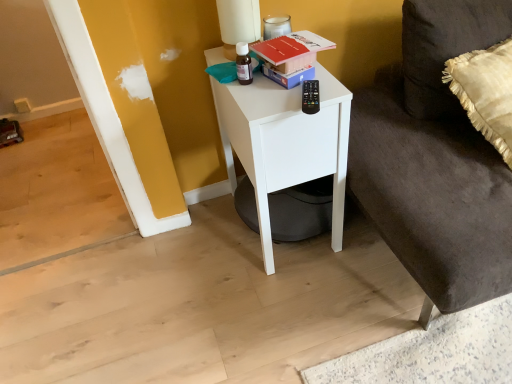
Question: Is white matte nightstand at center at the back of red matte book at upper center?

Choices:
 (A) yes
 (B) no

Answer: (B)

Question: Is red matte book at upper center positioned far away from white matte nightstand at center?

Choices:
 (A) no
 (B) yes

Answer: (A)

Question: From the image's perspective, is red matte book at upper center on top of white matte nightstand at center?

Choices:
 (A) no
 (B) yes

Answer: (B)

Question: Can you confirm if red matte book at upper center is positioned to the left of white matte nightstand at center?

Choices:
 (A) yes
 (B) no

Answer: (B)

Question: Is red matte book at upper center positioned before white matte nightstand at center?

Choices:
 (A) no
 (B) yes

Answer: (A)

Question: From a real-world perspective, is red matte book at upper center over white matte nightstand at center?

Choices:
 (A) yes
 (B) no

Answer: (A)

Question: Is silky beige pillow at right to the right of dark gray fabric couch at lower right from the viewer's perspective?

Choices:
 (A) yes
 (B) no

Answer: (B)

Question: Is there a large distance between silky beige pillow at right and dark gray fabric couch at lower right?

Choices:
 (A) no
 (B) yes

Answer: (A)

Question: From a real-world perspective, is silky beige pillow at right located beneath dark gray fabric couch at lower right?

Choices:
 (A) no
 (B) yes

Answer: (A)

Question: From the image's perspective, is silky beige pillow at right on top of dark gray fabric couch at lower right?

Choices:
 (A) yes
 (B) no

Answer: (A)

Question: Does silky beige pillow at right have a lesser height compared to dark gray fabric couch at lower right?

Choices:
 (A) no
 (B) yes

Answer: (A)

Question: Is silky beige pillow at right closer to the viewer compared to dark gray fabric couch at lower right?

Choices:
 (A) yes
 (B) no

Answer: (B)

Question: Is dark gray fabric couch at lower right positioned with its back to red matte book at upper center?

Choices:
 (A) yes
 (B) no

Answer: (B)